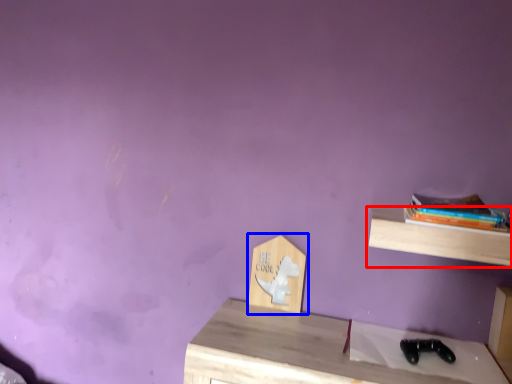
Question: Which point is closer to the camera, shelf (highlighted by a red box) or shelf (highlighted by a blue box)?

Choices:
 (A) shelf
 (B) shelf

Answer: (A)